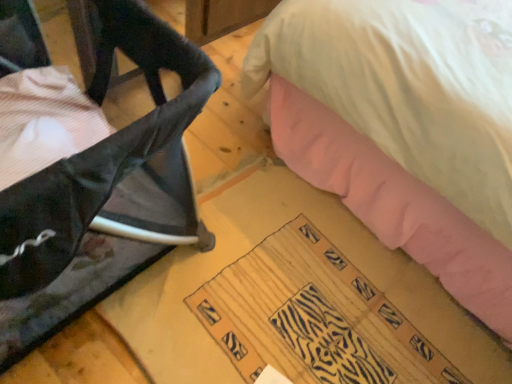
Where is `blank area to the left of zebra-patterned fabric at lower center`? blank area to the left of zebra-patterned fabric at lower center is located at coordinates (173, 292).